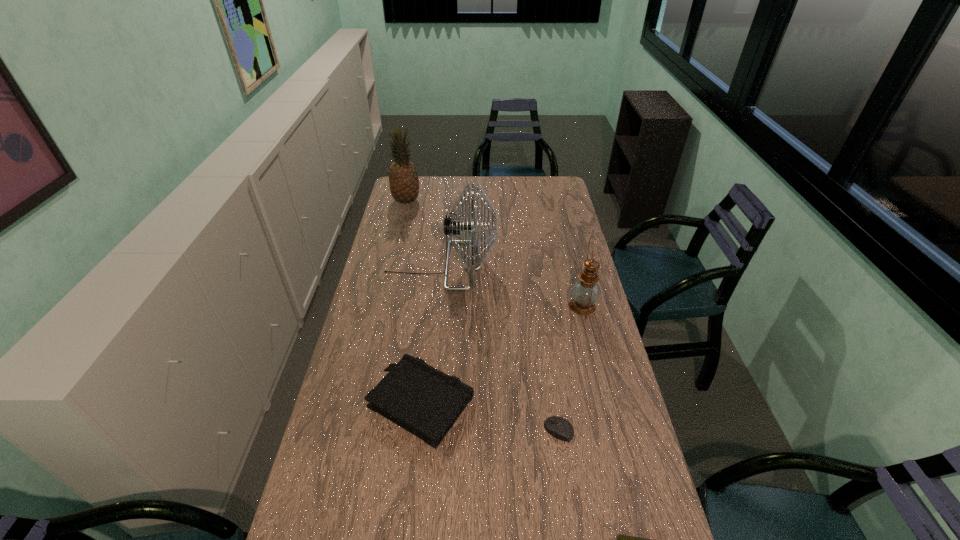
You are a GUI agent. You are given a task and a screenshot of the screen. Output one action in this format:
    pyautogui.click(x=<x>, y=<y>)
    Task: Click on the free space located 0.230m on the back of the second shortest object
    The image size is (960, 540).
    Given the screenshot: What is the action you would take?
    pyautogui.click(x=548, y=357)

At what (x,y) coordinates should I click in order to perform the action: click on object located in the far edge section of the desktop. Please return your answer as a coordinate pair (x, y). The height and width of the screenshot is (540, 960). Looking at the image, I should click on (403, 178).

The width and height of the screenshot is (960, 540). What are the coordinates of `pineapple that is at the left edge` in the screenshot? It's located at (403, 178).

At what (x,y) coordinates should I click in order to perform the action: click on fan positioned at the left edge. Please return your answer as a coordinate pair (x, y). The width and height of the screenshot is (960, 540). Looking at the image, I should click on (452, 227).

What are the coordinates of `Bible that is at the left edge` in the screenshot? It's located at (426, 402).

This screenshot has width=960, height=540. What are the coordinates of `object that is at the right edge` in the screenshot? It's located at (585, 292).

At what (x,y) coordinates should I click in order to perform the action: click on object that is at the far left corner. Please return your answer as a coordinate pair (x, y). The image size is (960, 540). Looking at the image, I should click on (403, 178).

In the image, there is a desktop. Where is `vacant space at the left edge`? This screenshot has width=960, height=540. vacant space at the left edge is located at coordinates (392, 305).

In the image, there is a desktop. In order to click on blank space at the right edge in this screenshot , I will do `click(537, 200)`.

Image resolution: width=960 pixels, height=540 pixels. What are the coordinates of `vacant space in between the fourth shortest object and the computer equipment` in the screenshot? It's located at (571, 368).